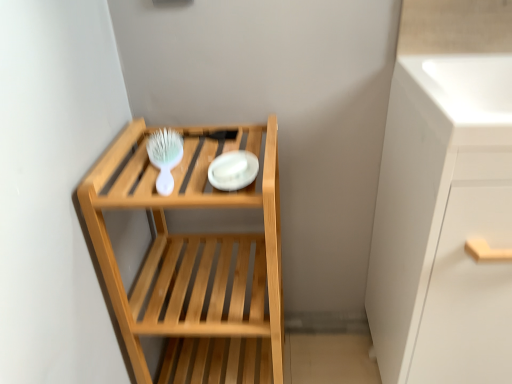
The height and width of the screenshot is (384, 512). Describe the element at coordinates (443, 223) in the screenshot. I see `white glossy cabinet at right` at that location.

Describe the element at coordinates (165, 157) in the screenshot. I see `white plastic brush at upper left` at that location.

What is the approximate width of white glossy plate at center?

5.09 inches.

What do you see at coordinates (194, 258) in the screenshot? This screenshot has height=384, width=512. I see `natural wood shelf at center` at bounding box center [194, 258].

At what (x,y) coordinates should I click in order to perform the action: click on white glossy sink at upper right. Please return your answer as a coordinate pair (x, y). Image resolution: width=512 pixels, height=384 pixels. Looking at the image, I should click on (466, 86).

At what (x,y) coordinates should I click in order to perform the action: click on cabinetry on the right of natural wood shelf at center. Please return your answer as a coordinate pair (x, y). This screenshot has width=512, height=384. Looking at the image, I should click on (443, 223).

Is white glossy cabinet at right completely or partially outside of natural wood shelf at center?

white glossy cabinet at right is positioned outside natural wood shelf at center.

How many degrees apart are the facing directions of white glossy cabinet at right and natural wood shelf at center?

There is a 0.768-degree angle between the facing directions of white glossy cabinet at right and natural wood shelf at center.

From a real-world perspective, which object rests below the other?

In real-world perspective, natural wood shelf at center is lower.

Does point (474, 80) appear closer or farther from the camera than point (226, 180)?

Point (474, 80) is positioned farther from the camera compared to point (226, 180).

In terms of width, does white glossy sink at upper right look wider or thinner when compared to white glossy plate at center?

In the image, white glossy sink at upper right appears to be wider than white glossy plate at center.

Considering the relative positions of white glossy sink at upper right and white glossy plate at center in the image provided, is white glossy sink at upper right in front of white glossy plate at center?

Yes, it is.

Can you confirm if white glossy sink at upper right is positioned to the right of white glossy plate at center?

Indeed, white glossy sink at upper right is positioned on the right side of white glossy plate at center.

From a real-world perspective, is natural wood shelf at center above or below white glossy cabinet at right?

natural wood shelf at center is below white glossy cabinet at right.

Does point (147, 371) come farther from viewer compared to point (426, 108)?

Yes, point (147, 371) is behind point (426, 108).

From the image's perspective, which one is positioned higher, natural wood shelf at center or white glossy cabinet at right?

white glossy cabinet at right.

Which is more to the left, natural wood shelf at center or white glossy cabinet at right?

natural wood shelf at center.

In the scene shown: How much distance is there between white glossy cabinet at right and white plastic brush at upper left?

white glossy cabinet at right is 20.77 inches away from white plastic brush at upper left.

From a real-world perspective, is white glossy cabinet at right on top of white plastic brush at upper left?

Actually, white glossy cabinet at right is physically below white plastic brush at upper left in the real world.

Is white glossy cabinet at right taller or shorter than white plastic brush at upper left?

white glossy cabinet at right is taller than white plastic brush at upper left.

Does white glossy cabinet at right turn towards white plastic brush at upper left?

No, white glossy cabinet at right is not oriented towards white plastic brush at upper left.

From a real-world perspective, between natural wood shelf at center and white glossy plate at center, who is vertically lower?

In real-world perspective, natural wood shelf at center is lower.

In the scene shown: Which object is positioned more to the right, natural wood shelf at center or white glossy plate at center?

Positioned to the right is white glossy plate at center.

Is point (254, 329) farther from camera compared to point (242, 178)?

Yes, point (254, 329) is behind point (242, 178).

Measure the distance between natural wood shelf at center and white glossy plate at center.

A distance of 11.67 inches exists between natural wood shelf at center and white glossy plate at center.

Is point (395, 147) closer to camera compared to point (242, 168)?

No, it is behind (242, 168).

In the scene shown: From a real-world perspective, is white glossy cabinet at right physically above white glossy plate at center?

No, from a real-world perspective, white glossy cabinet at right is not above white glossy plate at center.

From the image's perspective, is white glossy cabinet at right over white glossy plate at center?

No.

Does white glossy cabinet at right have a greater height compared to white glossy plate at center?

Indeed, white glossy cabinet at right has a greater height compared to white glossy plate at center.

Is white glossy plate at center taller than white glossy sink at upper right?

No.

In the scene shown: Considering the relative positions of white glossy plate at center and white glossy sink at upper right in the image provided, is white glossy plate at center to the right of white glossy sink at upper right from the viewer's perspective?

Incorrect, white glossy plate at center is not on the right side of white glossy sink at upper right.

From the image's perspective, is white glossy plate at center located above or below white glossy sink at upper right?

white glossy plate at center is situated lower than white glossy sink at upper right in the image.

Locate an element on the screen. This screenshot has height=384, width=512. platter lying below the white glossy sink at upper right (from the image's perspective) is located at coordinates (233, 170).

At what (x,y) coordinates should I click in order to perform the action: click on cabinetry located on the right of natural wood shelf at center. Please return your answer as a coordinate pair (x, y). This screenshot has width=512, height=384. Looking at the image, I should click on (443, 223).

In the image, there is a white glossy plate at center. In order to click on sink above it (from the image's perspective) in this screenshot , I will do `click(466, 86)`.

Estimate the real-world distances between objects in this image. Which object is closer to white glossy sink at upper right, natural wood shelf at center or white glossy plate at center?

white glossy plate at center is closer to white glossy sink at upper right.

From the image, which object appears to be nearer to white plastic brush at upper left, white glossy cabinet at right or white glossy plate at center?

white glossy plate at center is positioned closer to the anchor white plastic brush at upper left.

Looking at the image, which one is located further to white glossy sink at upper right, white plastic brush at upper left or natural wood shelf at center?

The object further to white glossy sink at upper right is natural wood shelf at center.

When comparing their distances from white plastic brush at upper left, does white glossy sink at upper right or white glossy cabinet at right seem further?

Among the two, white glossy sink at upper right is located further to white plastic brush at upper left.

Estimate the real-world distances between objects in this image. Which object is further from natural wood shelf at center, white glossy sink at upper right or white glossy plate at center?

white glossy sink at upper right is further to natural wood shelf at center.

Considering their positions, is natural wood shelf at center positioned closer to white glossy sink at upper right than white plastic brush at upper left?

white plastic brush at upper left is closer to white glossy sink at upper right.

Which object lies nearer to the anchor point white glossy cabinet at right, white glossy sink at upper right or natural wood shelf at center?

Based on the image, white glossy sink at upper right appears to be nearer to white glossy cabinet at right.

Looking at this image, considering their positions, is white plastic brush at upper left positioned closer to white glossy plate at center than white glossy sink at upper right?

white plastic brush at upper left lies closer to white glossy plate at center than the other object.

Find the location of a particular element. sink located between natural wood shelf at center and white glossy cabinet at right in the left-right direction is located at coordinates tap(466, 86).

You are a GUI agent. You are given a task and a screenshot of the screen. Output one action in this format:
    pyautogui.click(x=<x>, y=<y>)
    Task: Click on the platter between natural wood shelf at center and white glossy cabinet at right in the horizontal direction
    The height and width of the screenshot is (384, 512).
    Given the screenshot: What is the action you would take?
    233,170

What are the coordinates of `platter between natural wood shelf at center and white glossy sink at upper right` in the screenshot? It's located at (233, 170).

The height and width of the screenshot is (384, 512). I want to click on platter between white plastic brush at upper left and natural wood shelf at center from top to bottom, so click(x=233, y=170).